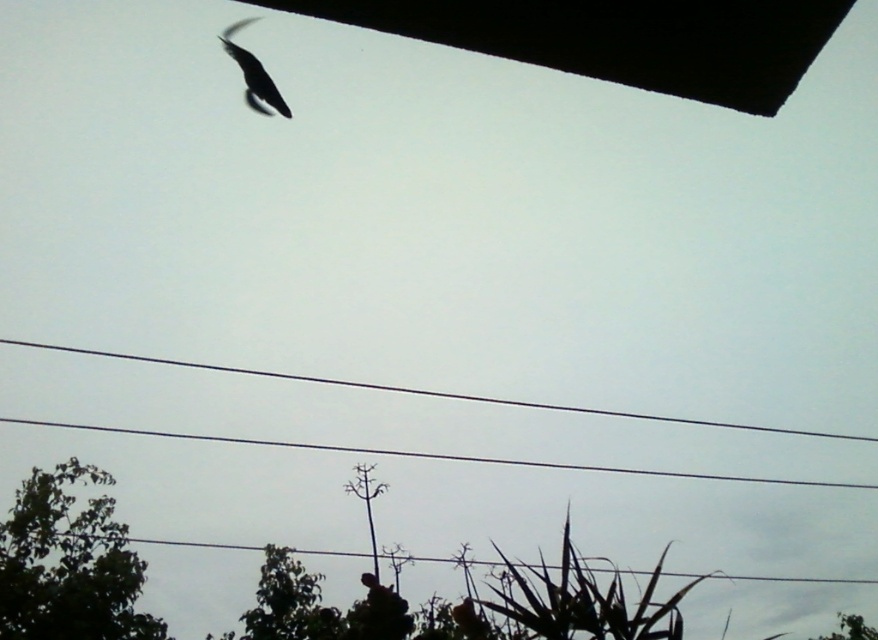
You are a birdwatcher trying to estimate distances in the scene. How far apart are the green leafy tree at lower left and the silvery glossy bird at upper left?

The green leafy tree at lower left is 11.88 meters from the silvery glossy bird at upper left.

You are an ornithologist observing the sky. You notice the silvery glossy bird at upper left and the green leafy tree at lower right. Which object is positioned more to the left side of the image?

The silvery glossy bird at upper left is positioned to the left of the green leafy tree at lower right, so the bird is more to the left.